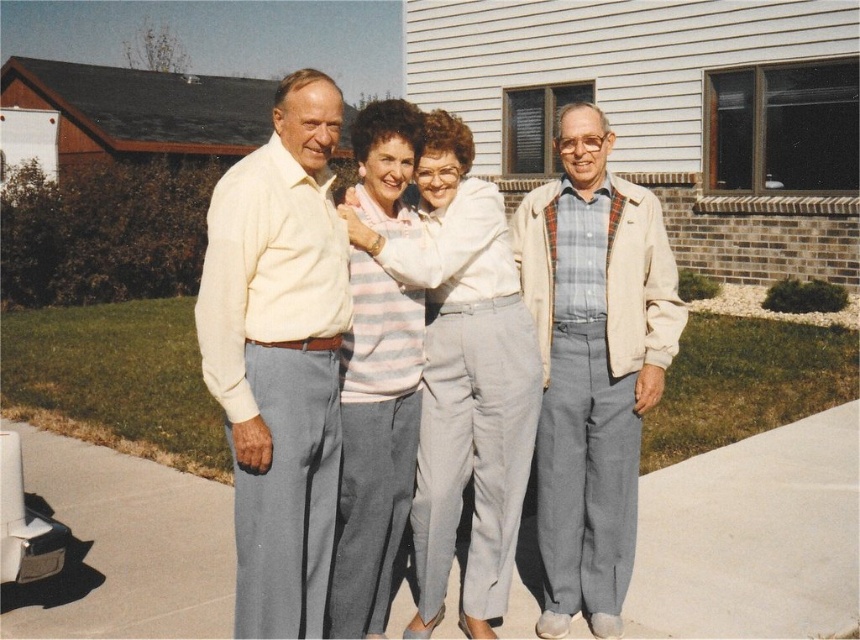
You are a tailor who needs to determine which clothing item requires more fabric for alterations. Based on the image, which clothing item between the light beige jacket at right and the striped knit sweater at center is taller?

The light beige jacket at right is taller than the striped knit sweater at center, so it would require more fabric for alterations.

You are a photographer trying to capture a group photo of the two people wearing the light beige jacket at right and the striped knit sweater at center. Since you want them to be closer in the photo, how much distance should you adjust between them?

The light beige jacket at right and striped knit sweater at center are 30.43 inches apart. To make them appear closer in the photo, you should move them 30.43 inches closer together.